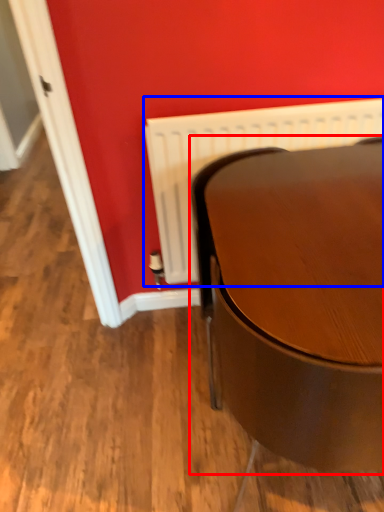
Question: Which of the following is the closest to the observer, table (highlighted by a red box) or radiator (highlighted by a blue box)?

Choices:
 (A) table
 (B) radiator

Answer: (A)